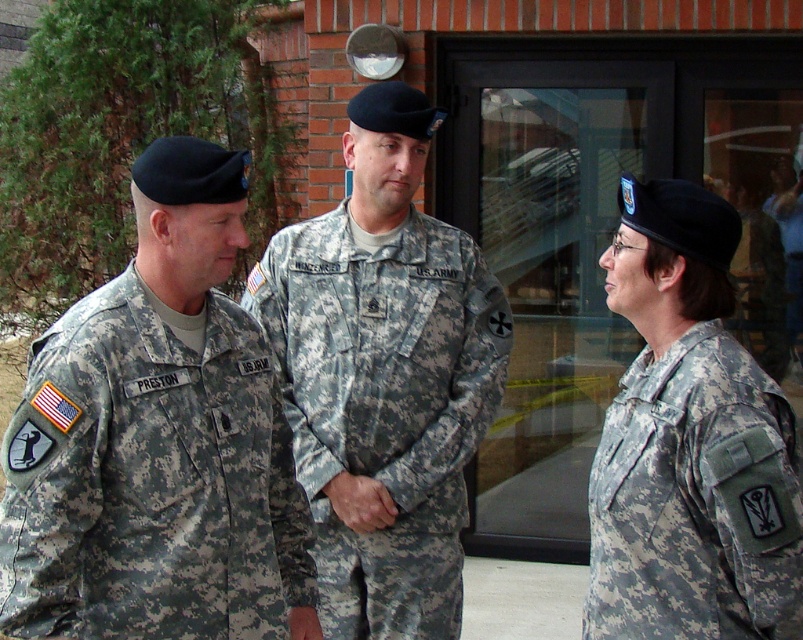
You are an observer standing in front of the brick building. You see the camouflage fabric uniform at left and the camouflage uniform at center. Which one is closer to you?

The camouflage fabric uniform at left is closer to you because it is in front of the camouflage uniform at center.

You are a photographer trying to capture a group photo of the camouflage uniform at center and the camouflage fabric uniform at right. Since you want to ensure both are visible, which one should you place on the left side of the frame to avoid overlapping?

The camouflage uniform at center should be placed on the left side of the frame because it is already positioned to the left of the camouflage fabric uniform at right in the original image.